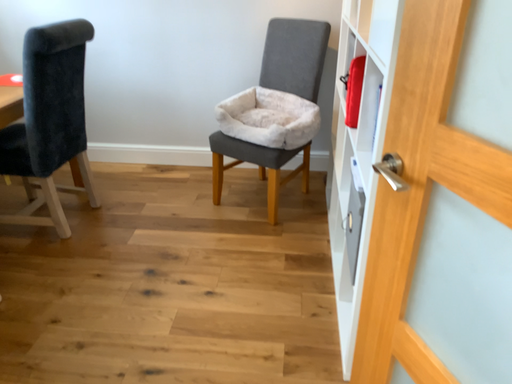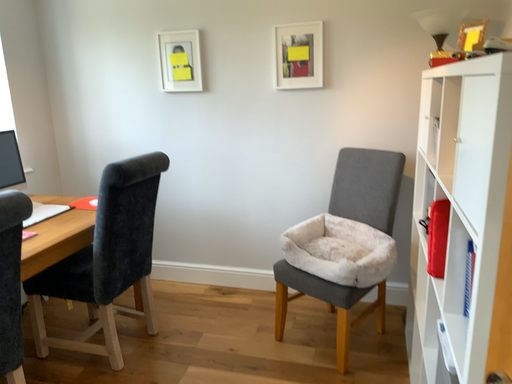
Question: Which way did the camera rotate in the video?

Choices:
 (A) rotated left
 (B) rotated right

Answer: (A)